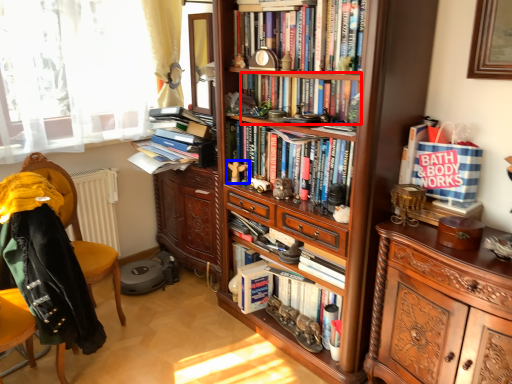
Question: Among these objects, which one is nearest to the camera, book (highlighted by a red box) or toy (highlighted by a blue box)?

Choices:
 (A) book
 (B) toy

Answer: (A)